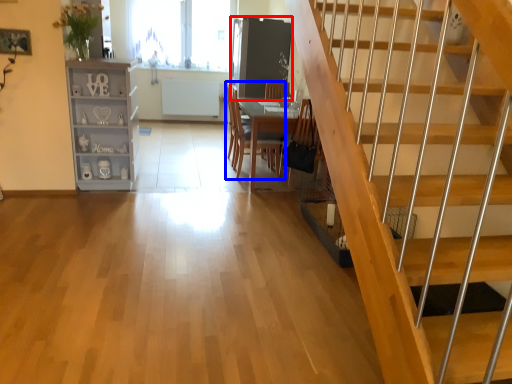
Question: Which point is closer to the camera, glass door (highlighted by a red box) or chair (highlighted by a blue box)?

Choices:
 (A) glass door
 (B) chair

Answer: (B)